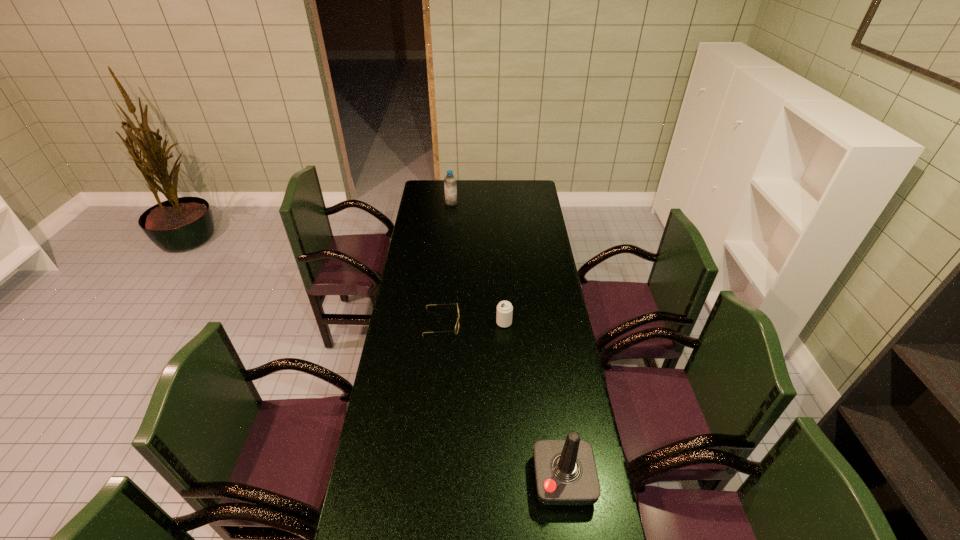
You are a GUI agent. You are given a task and a screenshot of the screen. Output one action in this format:
    pyautogui.click(x=<x>, y=<y>)
    Task: Click on the empty space that is in between the rightmost object and the shortest object
    
    Given the screenshot: What is the action you would take?
    pyautogui.click(x=502, y=401)

The image size is (960, 540). I want to click on blank region between the spectacles and the tallest object, so click(502, 401).

Locate an element on the screen. This screenshot has width=960, height=540. empty space that is in between the joystick and the can is located at coordinates (534, 401).

The width and height of the screenshot is (960, 540). I want to click on vacant space that is in between the third shortest object and the third tallest object, so click(478, 263).

Identify the location of free area in between the second object from right to left and the shortest object. The width and height of the screenshot is (960, 540). (473, 322).

Where is `free space between the spectacles and the nearest object`? The width and height of the screenshot is (960, 540). free space between the spectacles and the nearest object is located at coordinates (502, 401).

Find the location of a particular element. vacant area between the farthest object and the tallest object is located at coordinates (507, 341).

Image resolution: width=960 pixels, height=540 pixels. In order to click on free space between the joystick and the second tallest object in this screenshot , I will do `click(507, 341)`.

This screenshot has width=960, height=540. Find the location of `object that is the closest one to the second shortest object`. object that is the closest one to the second shortest object is located at coordinates (457, 324).

Image resolution: width=960 pixels, height=540 pixels. I want to click on object that is the third closest to the water bottle, so click(565, 470).